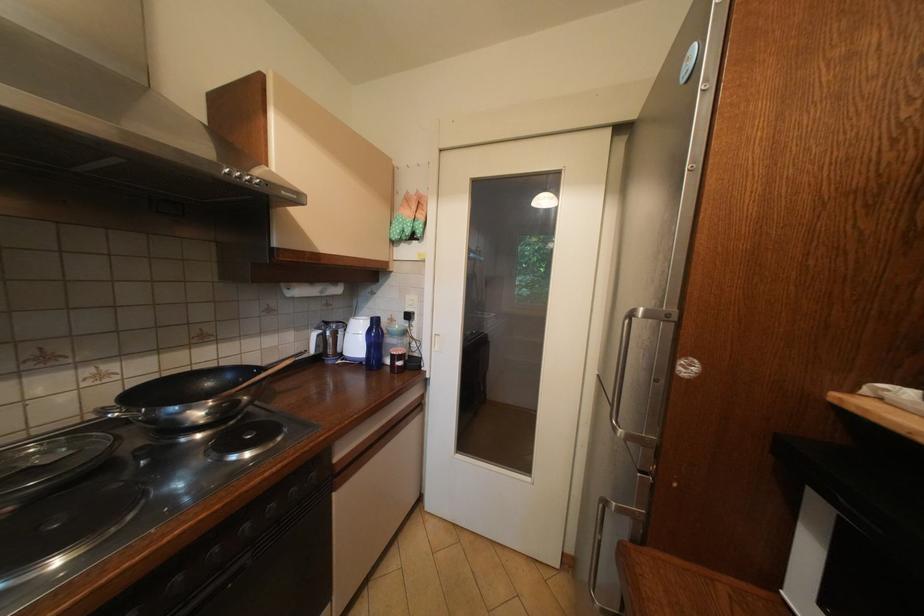
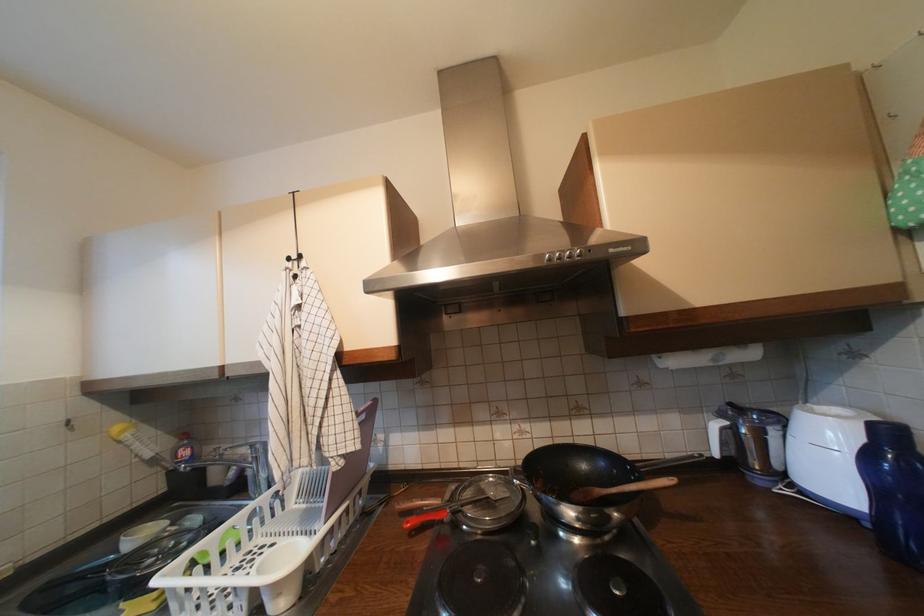
Locate, in the second image, the point that corresponds to the point at 297,290 in the first image.

(669, 359)